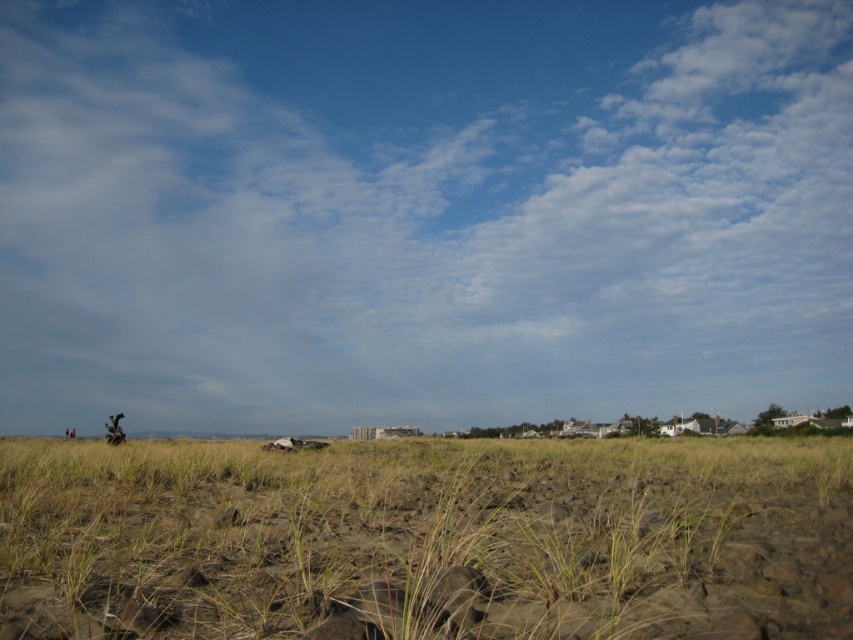
Is white fluffy cloud at upper center bigger than brown sandy dirt field at center?

Indeed, white fluffy cloud at upper center has a larger size compared to brown sandy dirt field at center.

Between white fluffy cloud at upper center and brown sandy dirt field at center, which one appears on the left side from the viewer's perspective?

From the viewer's perspective, white fluffy cloud at upper center appears more on the left side.

Is point (734, 401) positioned before point (397, 461)?

No.

What are the coordinates of `white fluffy cloud at upper center` in the screenshot? It's located at (421, 212).